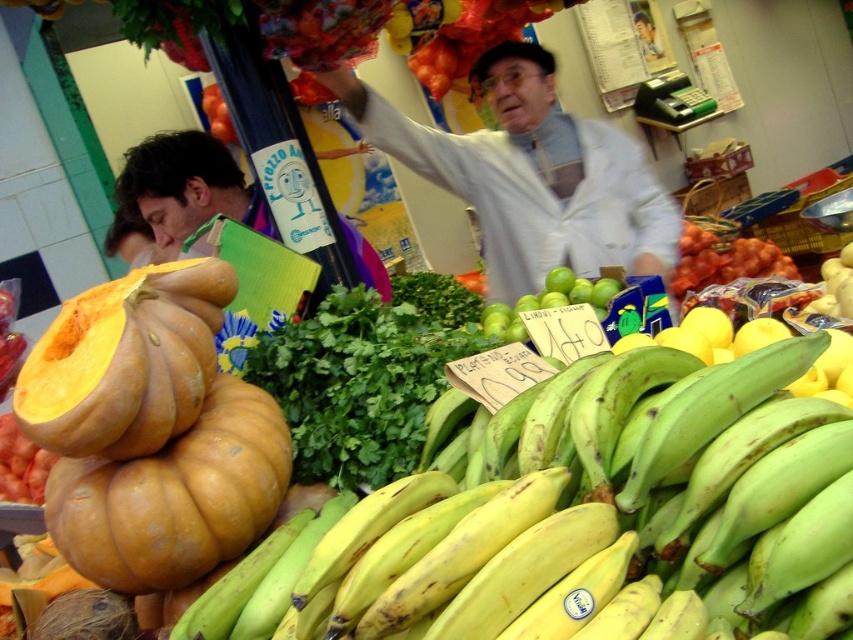
Question: Which object appears farthest from the camera in this image?

Choices:
 (A) green leafy at center
 (B) yellow-green smooth bananas at lower left
 (C) light gray jacket at center

Answer: (A)

Question: Does green leafymaterial/texturevegetable at center have a smaller size compared to shiny orange tomatoes at center?

Choices:
 (A) yes
 (B) no

Answer: (A)

Question: Which of the following is the closest to the observer?

Choices:
 (A) green leafymaterial/texturevegetable at center
 (B) orange matte pumpkin at left
 (C) shiny orange tomatoes at center

Answer: (B)

Question: Is light gray jacket at center to the left of green matte limes at center from the viewer's perspective?

Choices:
 (A) yes
 (B) no

Answer: (A)

Question: Is orange matte pumpkin at left thinner than green leafymaterial/texturevegetable at center?

Choices:
 (A) yes
 (B) no

Answer: (A)

Question: Among these points, which one is nearest to the camera?

Choices:
 (A) (834, 465)
 (B) (619, 154)
 (C) (253, 342)
 (D) (691, 268)

Answer: (A)